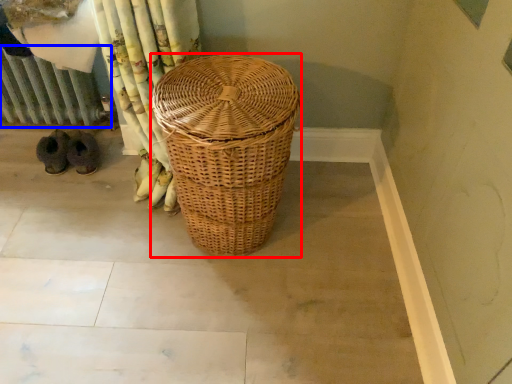
Question: Which point is further to the camera, picnic basket (highlighted by a red box) or radiator (highlighted by a blue box)?

Choices:
 (A) picnic basket
 (B) radiator

Answer: (B)